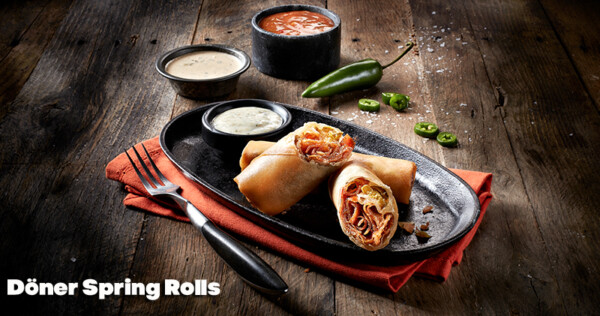
Where is `bowl`? The width and height of the screenshot is (600, 316). bowl is located at coordinates (210, 125), (162, 65), (264, 34).